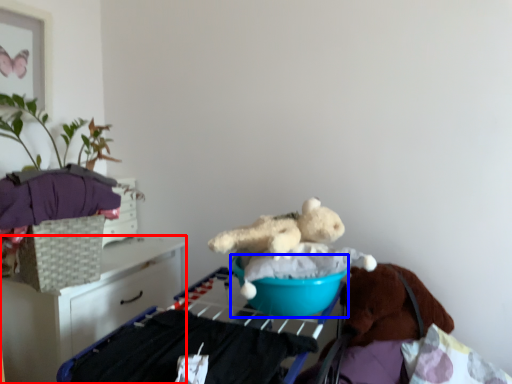
Question: Among these objects, which one is farthest to the camera, furniture (highlighted by a red box) or basin (highlighted by a blue box)?

Choices:
 (A) furniture
 (B) basin

Answer: (A)